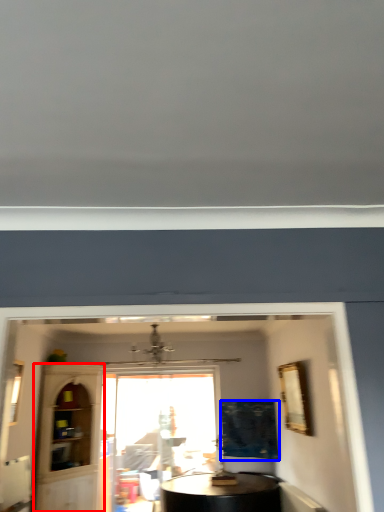
Question: Which of the following is the closest to the observer, glass door (highlighted by a red box) or curtain (highlighted by a blue box)?

Choices:
 (A) glass door
 (B) curtain

Answer: (A)